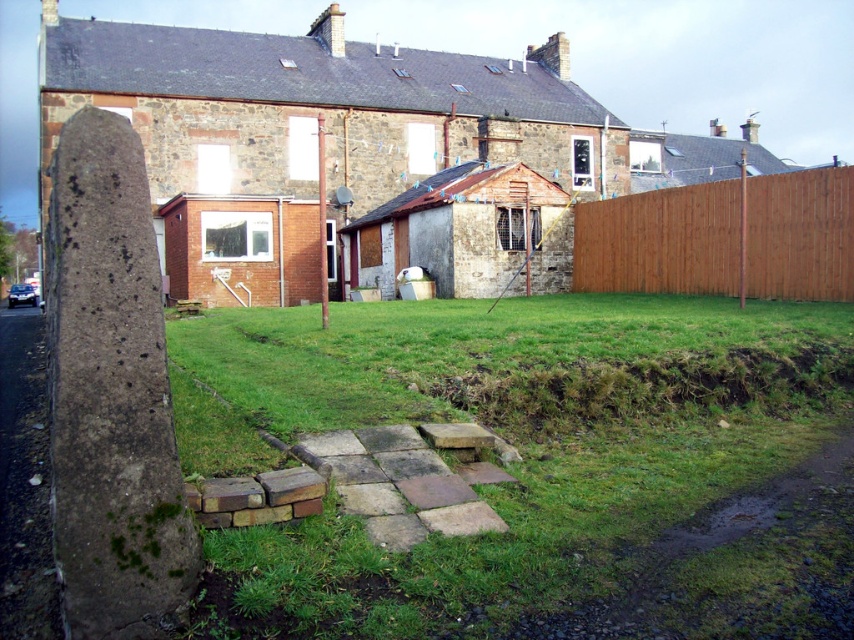
How much distance is there between brown rough stone pillar at left and brown wooden fence at right?

They are 53.54 feet apart.

Is brown rough stone pillar at left above brown wooden fence at right?

No, brown rough stone pillar at left is not above brown wooden fence at right.

Between point (126, 596) and point (759, 196), which one is positioned behind?

The point (759, 196) is more distant.

This screenshot has height=640, width=854. Find the location of `brown rough stone pillar at left`. brown rough stone pillar at left is located at coordinates (110, 394).

Who is more forward, (276, 620) or (598, 248)?

Point (276, 620) is in front.

Does green grassy at center have a greater height compared to brown wooden fence at right?

No.

Is point (618, 570) behind point (677, 240)?

No, it is not.

At what (x,y) coordinates should I click in order to perform the action: click on green grassy at center. Please return your answer as a coordinate pair (x, y). Looking at the image, I should click on (507, 438).

Is the position of green grassy at center less distant than that of brown rough stone pillar at left?

Yes.

Is green grassy at center wider than brown rough stone pillar at left?

Yes.

Is point (309, 362) in front of point (80, 268)?

No, it is not.

The height and width of the screenshot is (640, 854). I want to click on green grassy at center, so click(507, 438).